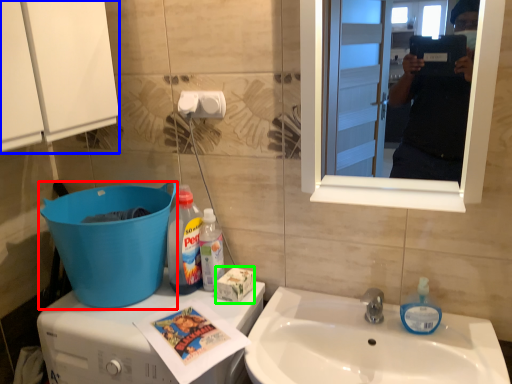
Question: Which object is the closest to the trash bin/can (highlighted by a red box)? Choose among these: cabinetry (highlighted by a blue box) or box (highlighted by a green box).

Choices:
 (A) cabinetry
 (B) box

Answer: (B)